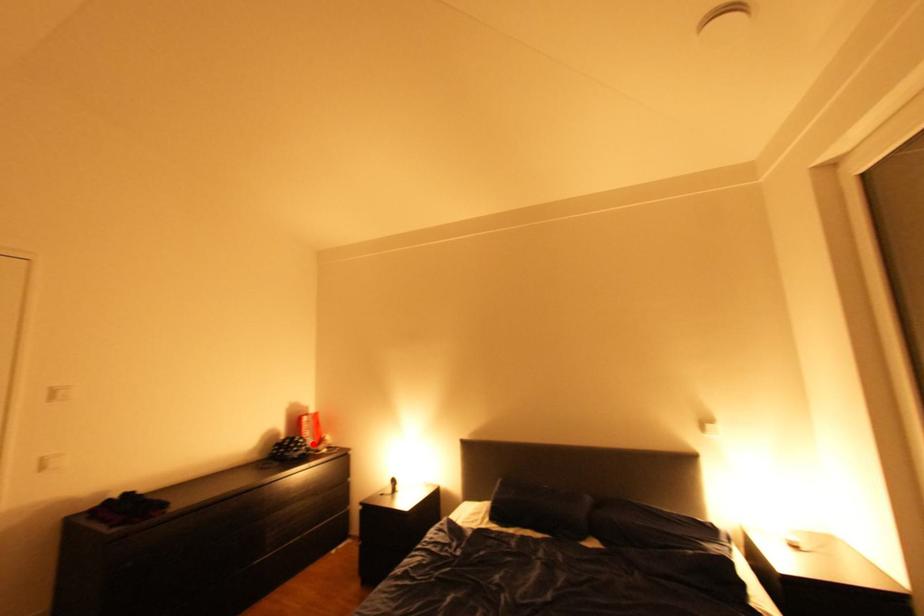
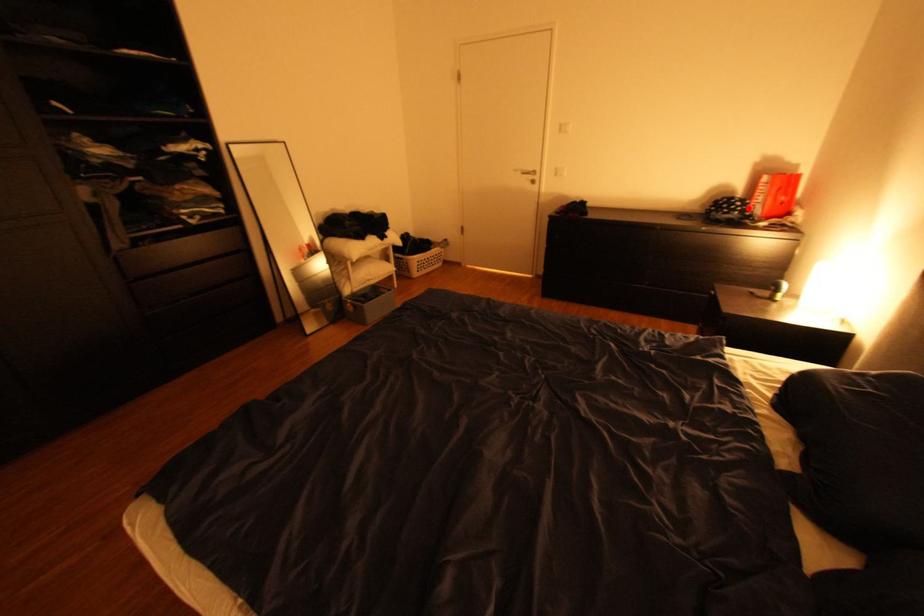
I am providing you with two images of the same scene from different viewpoints. A red point is marked on the first image and another point is marked on the second image. Is the red point in image1 aligned with the point shown in image2?

Yes